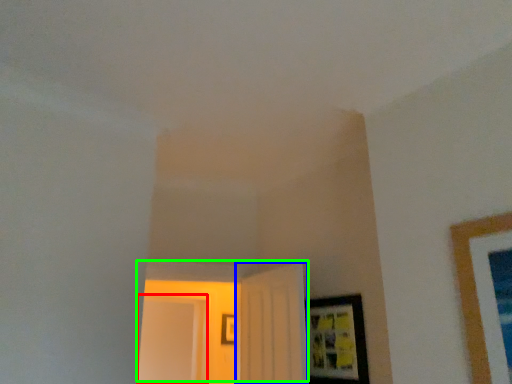
Question: Based on their relative distances, which object is farther from glass door (highlighted by a red box)? Choose from door (highlighted by a blue box) and door (highlighted by a green box).

Choices:
 (A) door
 (B) door

Answer: (A)